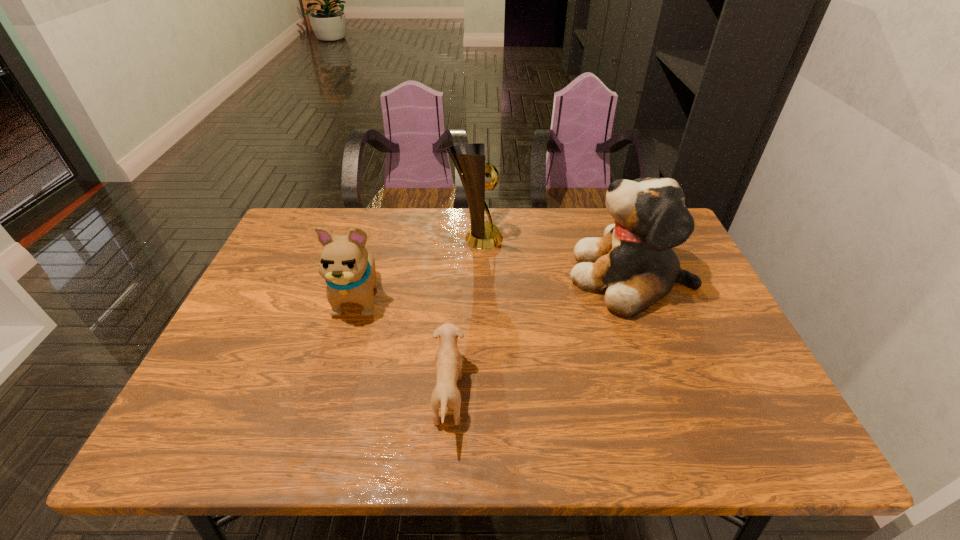
In order to click on free location at the right edge of the desktop in this screenshot , I will do `click(680, 325)`.

The image size is (960, 540). In the image, there is a desktop. In order to click on vacant area at the far left corner in this screenshot , I will do `click(311, 224)`.

You are a GUI agent. You are given a task and a screenshot of the screen. Output one action in this format:
    pyautogui.click(x=<x>, y=<y>)
    Task: Click on the free space at the near left corner
    Image resolution: width=960 pixels, height=540 pixels.
    Given the screenshot: What is the action you would take?
    pyautogui.click(x=228, y=431)

In order to click on free space at the near right corner of the desktop in this screenshot , I will do `click(774, 432)`.

The image size is (960, 540). Find the location of `vacant area between the award and the shortest puppy`. vacant area between the award and the shortest puppy is located at coordinates (463, 318).

Where is `free space between the award and the nearest puppy`? free space between the award and the nearest puppy is located at coordinates (463, 318).

The width and height of the screenshot is (960, 540). Find the location of `free space that is in between the leftmost object and the rightmost puppy`. free space that is in between the leftmost object and the rightmost puppy is located at coordinates (495, 286).

You are a GUI agent. You are given a task and a screenshot of the screen. Output one action in this format:
    pyautogui.click(x=<x>, y=<y>)
    Task: Click on the free area in between the second puppy from right to left and the rightmost object
    This screenshot has height=540, width=960.
    Given the screenshot: What is the action you would take?
    pyautogui.click(x=540, y=336)

Locate an element on the screen. vacant space that's between the rightmost object and the award is located at coordinates (554, 258).

The width and height of the screenshot is (960, 540). Identify the location of unoccupied position between the nearest puppy and the leftmost puppy. (404, 346).